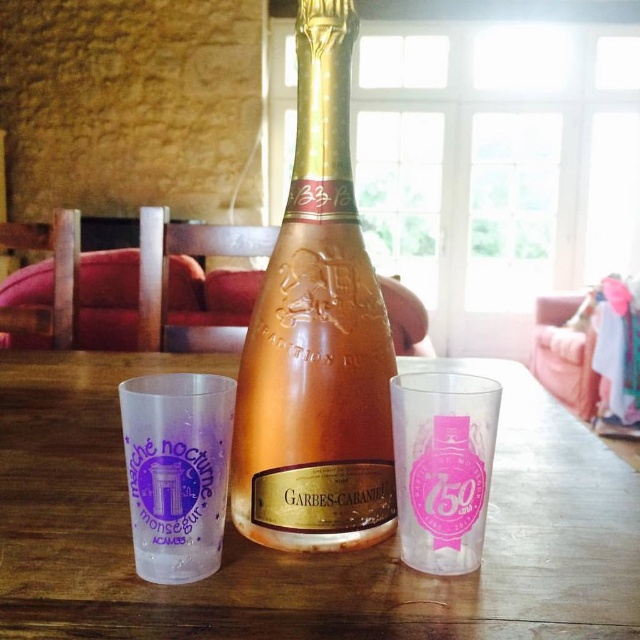
Between wooden table at center and transparent plastic cup at lower left, which one appears on the left side from the viewer's perspective?

transparent plastic cup at lower left is more to the left.

Does wooden table at center come behind transparent plastic cup at lower left?

No.

Between point (364, 588) and point (170, 508), which one is positioned behind?

The point (364, 588) is more distant.

In order to click on wooden table at center in this screenshot , I will do `click(304, 554)`.

In the scene shown: Does pink glass bottle at center appear over transparent plastic cup at lower left?

Indeed, pink glass bottle at center is positioned over transparent plastic cup at lower left.

Describe the element at coordinates (316, 336) in the screenshot. This screenshot has height=640, width=640. I see `pink glass bottle at center` at that location.

This screenshot has height=640, width=640. In order to click on pink glass bottle at center in this screenshot , I will do `click(316, 336)`.

Is wooden table at center in front of transparent plastic cup at center?

Yes, wooden table at center is in front of transparent plastic cup at center.

Find the location of a particular element. wooden table at center is located at coordinates (304, 554).

Where is `wooden table at center`? The width and height of the screenshot is (640, 640). wooden table at center is located at coordinates tap(304, 554).